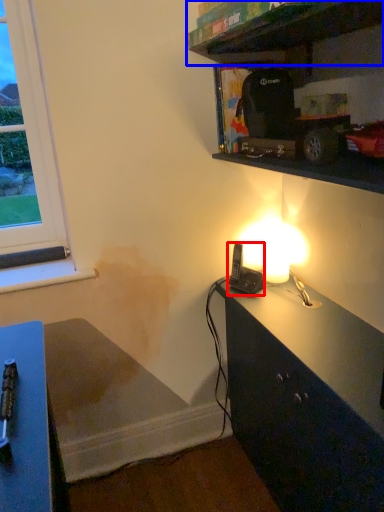
Question: Which point is further to the camera, equipment (highlighted by a red box) or shelf (highlighted by a blue box)?

Choices:
 (A) equipment
 (B) shelf

Answer: (A)